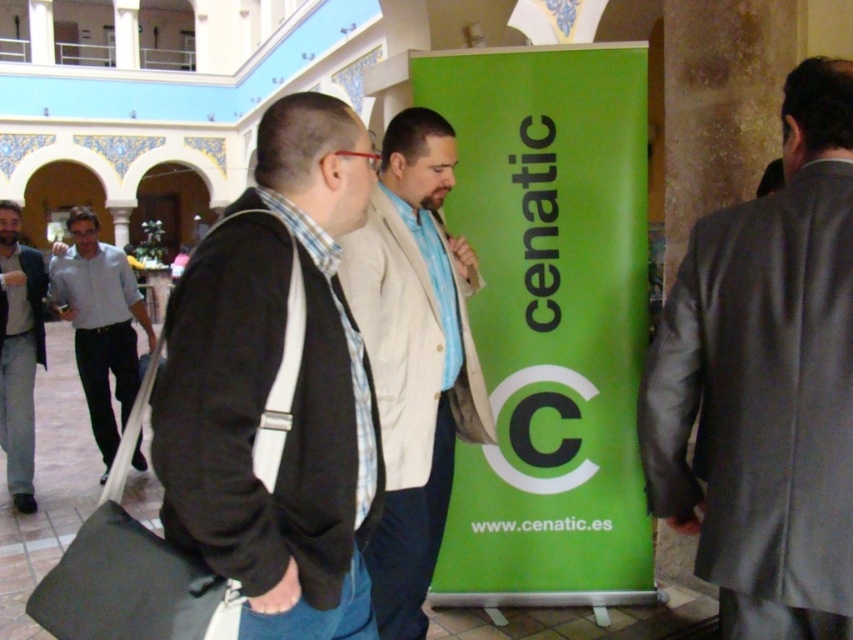
You are an event organizer planning to hang a large poster on the wall between the dark gray sweater at center and the light beige jacket at center. Since the poster requires a certain amount of space, can you determine which object is smaller so you know where to place it?

The dark gray sweater at center is smaller than the light beige jacket at center, so the poster should be placed near the smaller dark gray sweater at center to ensure enough space.